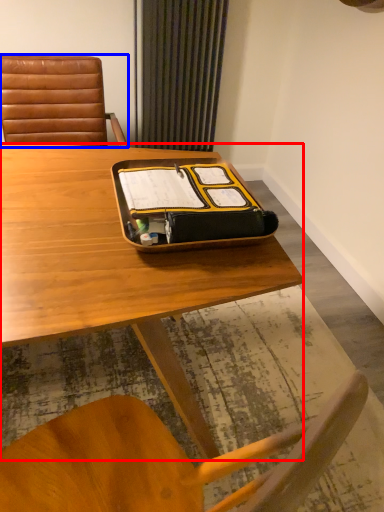
Question: Which of the following is the closest to the observer, desk (highlighted by a red box) or chair (highlighted by a blue box)?

Choices:
 (A) desk
 (B) chair

Answer: (A)